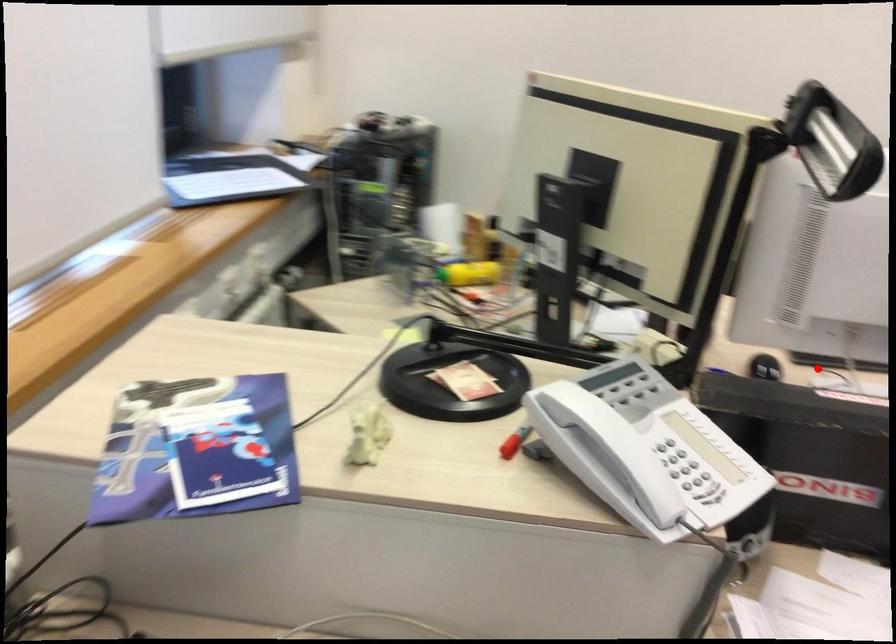
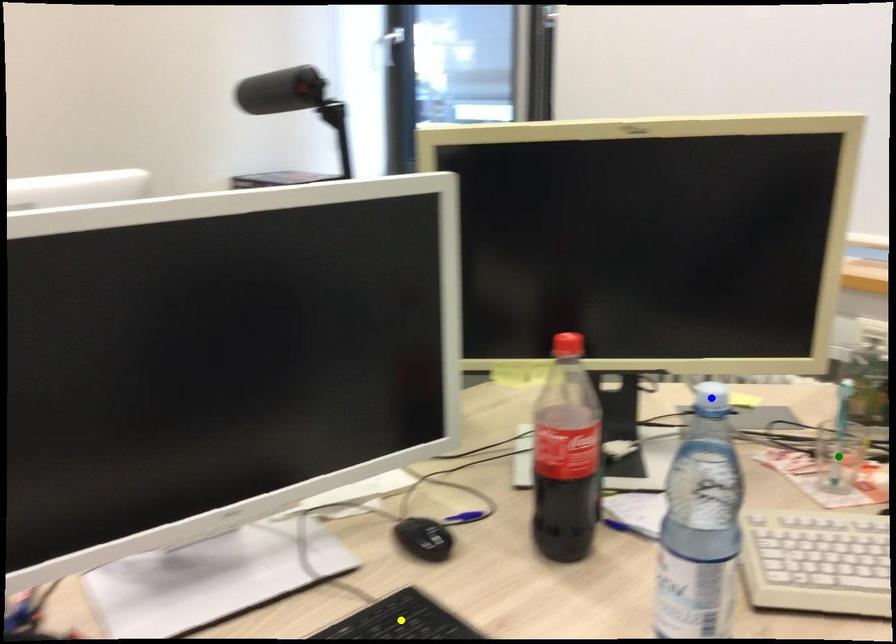
Question: I am providing you with two images of the same scene from different viewpoints. A red point is marked on the first image. You are given multiple points on the second image. Which point in image 2 is actually the same real-world point as the red point in image 1?

Choices:
 (A) blue point
 (B) yellow point
 (C) green point

Answer: (B)